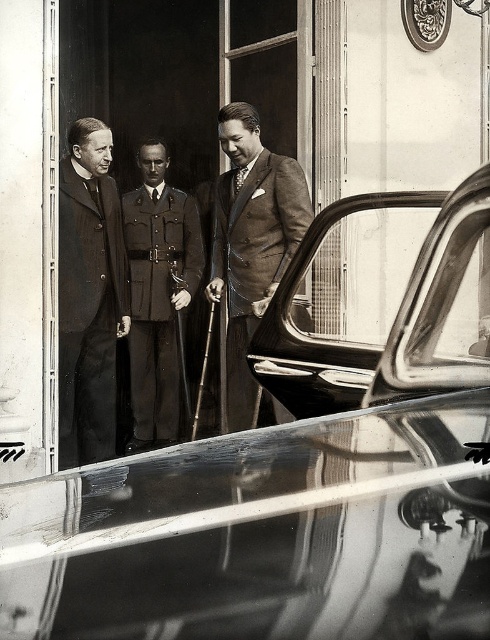
You are taking a photo of two points in the scene. The first point is at coordinate point (298, 385) and the second is at point (171, 282). Which point is closer to the camera?

Point (298, 385) is closer to the camera than point (171, 282).

You are a photographer trying to capture a detailed shot of the shiny chrome car at center and the brown wool suit at center. Since you can only focus on one object at a time, which one should you choose to ensure it appears sharp in the photo?

The shiny chrome car at center is closer to the viewer than the brown wool suit at center, so focusing on the shiny chrome car at center will ensure it appears sharp, while the brown wool suit at center may appear slightly out of focus due to the depth of field.

You are a photographer trying to capture a detailed shot of the shiny chrome door at center and the uniformed military at center. Since the camera can only focus on one subject at a time, which object should you aim for first if you want to ensure the other is still in the frame?

The shiny chrome door at center is to the right of the uniformed military at center, so you should aim for the uniformed military at center first to ensure the door remains in the frame.